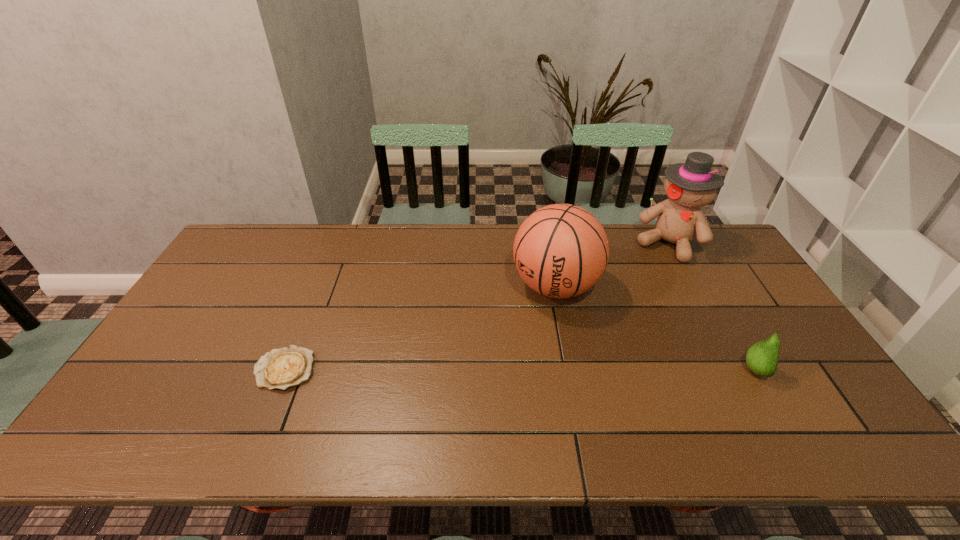
This screenshot has height=540, width=960. What are the coordinates of `blank region between the third tallest object and the shortest object` in the screenshot? It's located at (518, 370).

In order to click on vacant space that is in between the second object from left to right and the shortest object in this screenshot , I will do `click(420, 328)`.

At what (x,y) coordinates should I click in order to perform the action: click on free space between the rag_doll and the third object from right to left. Please return your answer as a coordinate pair (x, y). Looking at the image, I should click on pyautogui.click(x=612, y=265).

Image resolution: width=960 pixels, height=540 pixels. I want to click on vacant area that lies between the third tallest object and the rag_doll, so click(710, 307).

The width and height of the screenshot is (960, 540). Identify the location of free space that is in between the second shortest object and the basketball. (654, 328).

This screenshot has width=960, height=540. I want to click on vacant space in between the rag_doll and the leftmost object, so click(x=476, y=307).

Choose which object is the nearest neighbor to the rag_doll. Please provide its 2D coordinates. Your answer should be formatted as a tuple, i.e. [(x, y)], where the tuple contains the x and y coordinates of a point satisfying the conditions above.

[(561, 250)]

At what (x,y) coordinates should I click in order to perform the action: click on object that is the closest to the rag_doll. Please return your answer as a coordinate pair (x, y). This screenshot has height=540, width=960. Looking at the image, I should click on (561, 250).

At what (x,y) coordinates should I click in order to perform the action: click on vacant space that satisfies the following two spatial constraints: 1. on the front side of the quiche; 2. on the cut side of the third tallest object. Please return your answer as a coordinate pair (x, y). Looking at the image, I should click on (283, 371).

This screenshot has width=960, height=540. I want to click on vacant region that satisfies the following two spatial constraints: 1. on the front side of the second shortest object; 2. on the cut side of the rag_doll, so [736, 371].